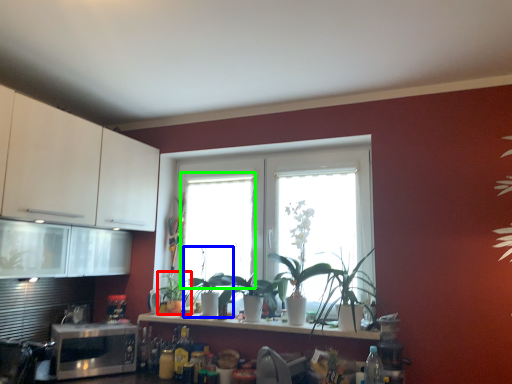
Question: Which is nearer to the plant (highlighted by a red box)? plant (highlighted by a blue box) or window (highlighted by a green box).

Choices:
 (A) plant
 (B) window

Answer: (A)